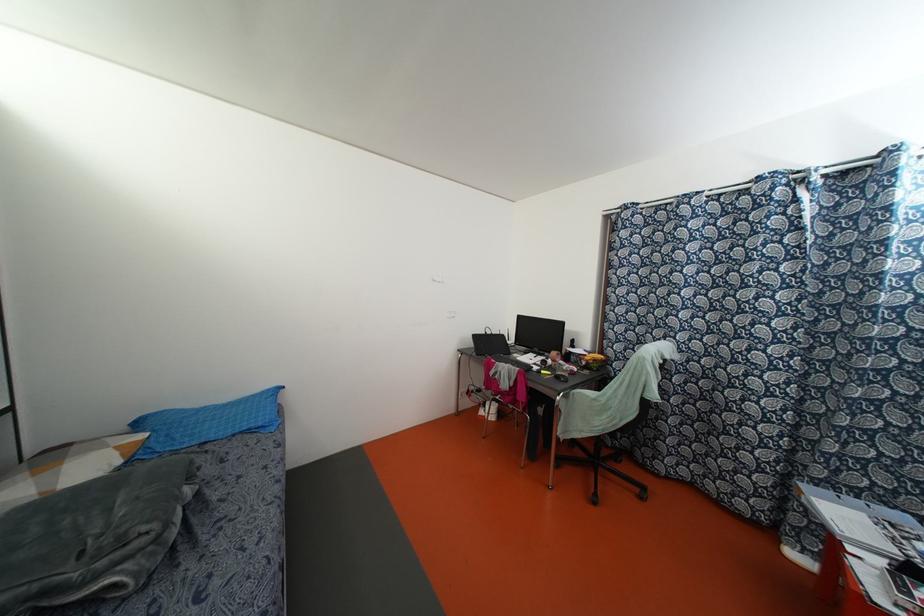
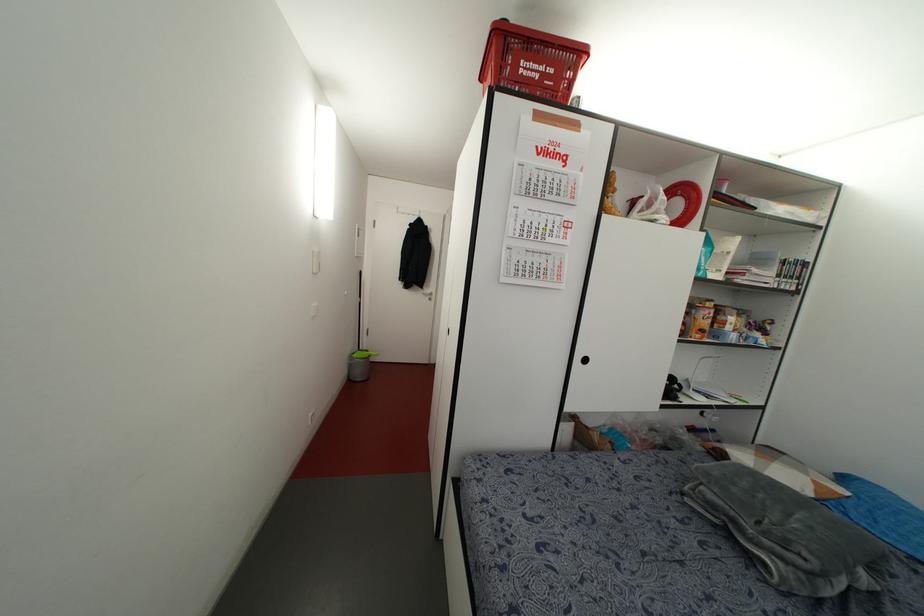
Question: The images are taken continuously from a first-person perspective. In which direction is your viewpoint rotating?

Choices:
 (A) Left
 (B) Right
 (C) Up
 (D) Down

Answer: (A)